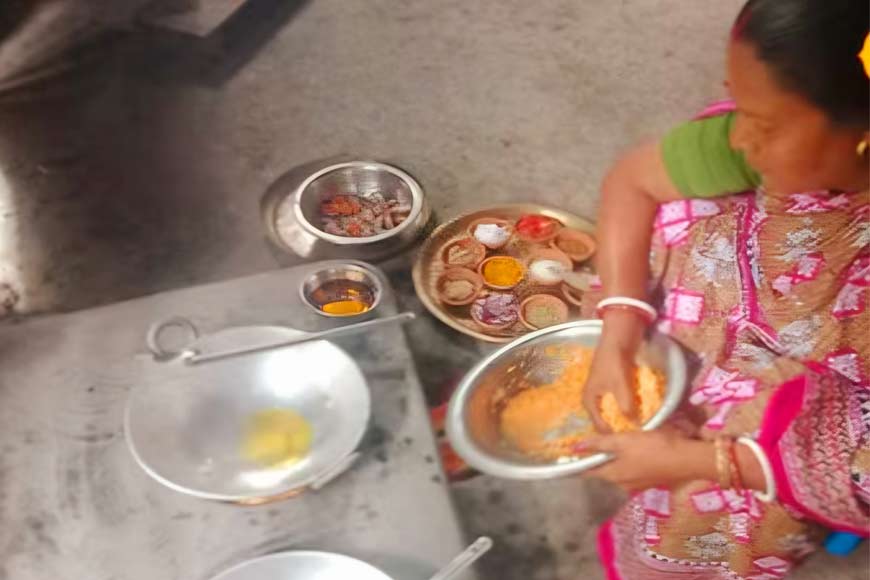
This screenshot has width=870, height=580. Find the location of `floor`. floor is located at coordinates (533, 126).